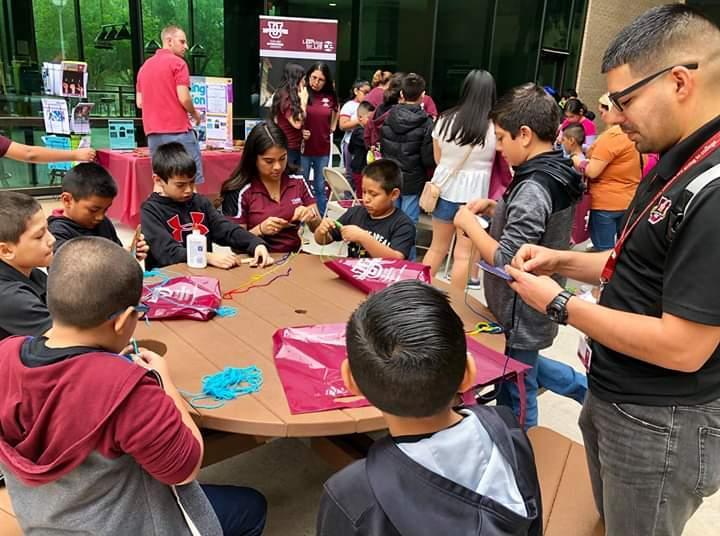
The width and height of the screenshot is (720, 536). Identify the location of chair. (576, 501), (4, 528).